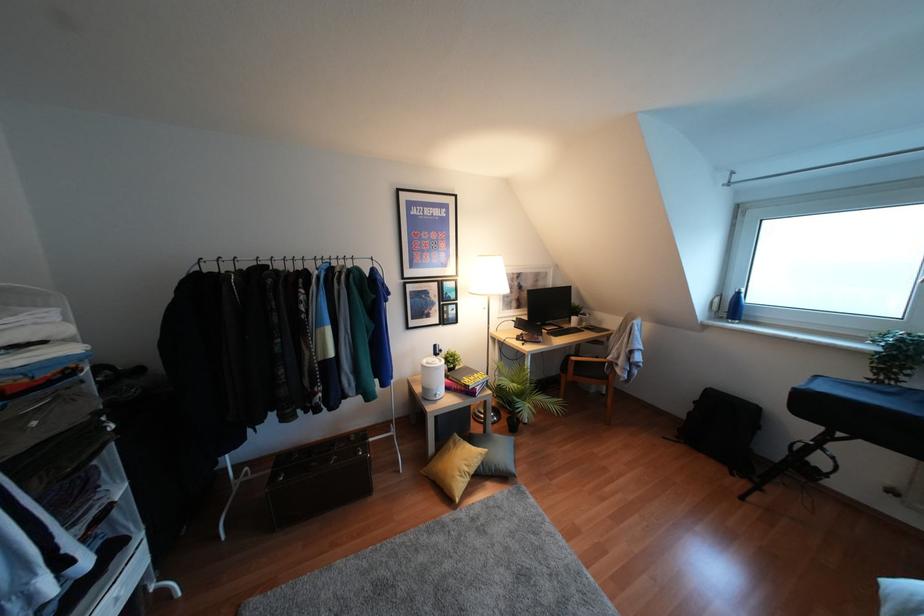
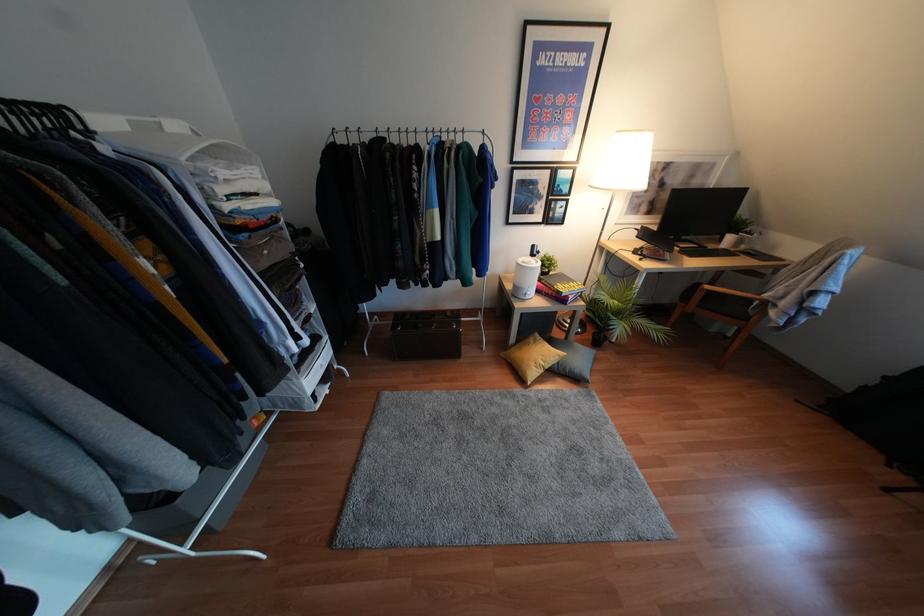
The point at (x=481, y=463) is marked in the first image. Where is the corresponding point in the second image?

(556, 362)